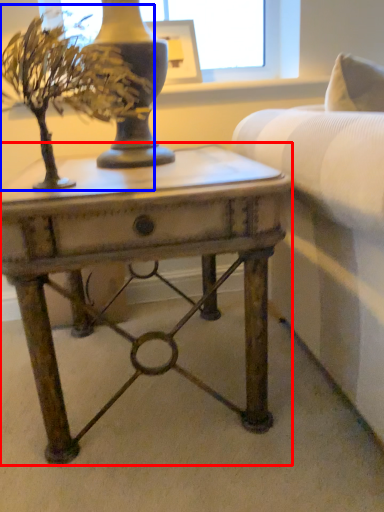
Question: Which object is further to the camera taking this photo, table (highlighted by a red box) or houseplant (highlighted by a blue box)?

Choices:
 (A) table
 (B) houseplant

Answer: (A)